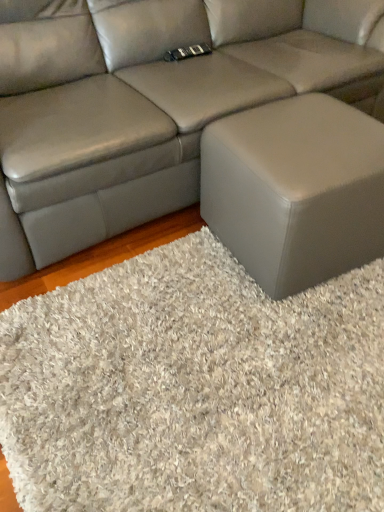
Question: In terms of size, does matte gray ottoman at lower right appear bigger or smaller than white shaggy rug at lower right?

Choices:
 (A) small
 (B) big

Answer: (B)

Question: From a real-world perspective, is matte gray ottoman at lower right physically located above or below white shaggy rug at lower right?

Choices:
 (A) above
 (B) below

Answer: (A)

Question: Which is nearer to the matte gray leather couch at center?

Choices:
 (A) white shaggy rug at lower right
 (B) matte gray ottoman at lower right

Answer: (B)

Question: Which object is the closest to the matte gray ottoman at lower right?

Choices:
 (A) white shaggy rug at lower right
 (B) matte gray leather couch at center

Answer: (A)